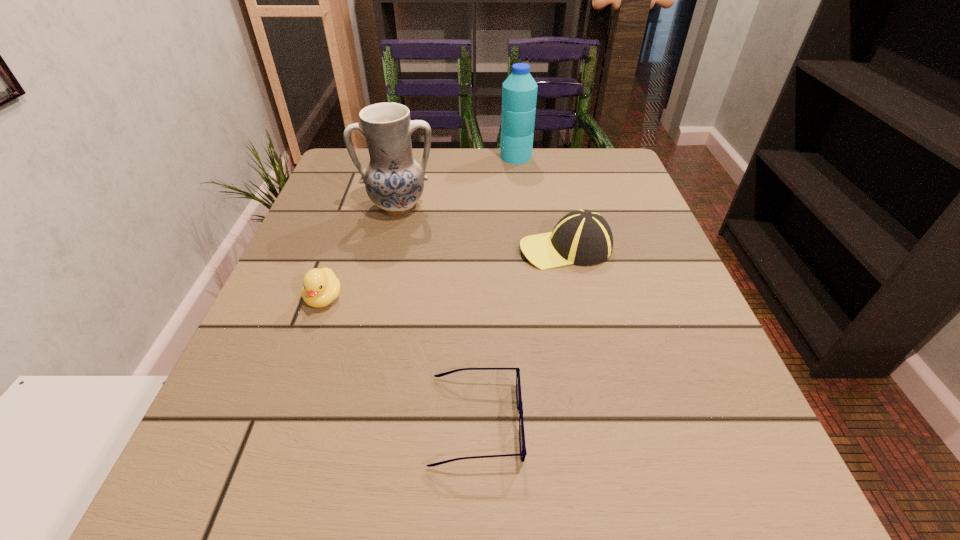
You are a GUI agent. You are given a task and a screenshot of the screen. Output one action in this format:
    pyautogui.click(x=<x>, y=<y>)
    Task: Click on the vacant space at the far edge of the desktop
    
    Given the screenshot: What is the action you would take?
    pyautogui.click(x=433, y=167)

In the image, there is a desktop. Find the location of `free space at the left edge`. free space at the left edge is located at coordinates (232, 416).

In the image, there is a desktop. Identify the location of vacant region at the right edge. (627, 291).

You are a GUI agent. You are given a task and a screenshot of the screen. Output one action in this format:
    pyautogui.click(x=<x>, y=<y>)
    Task: Click on the free space at the far left corner
    
    Given the screenshot: What is the action you would take?
    pyautogui.click(x=349, y=179)

In the image, there is a desktop. At what (x,y) coordinates should I click in order to perform the action: click on vacant space at the near left corner. Please return your answer as a coordinate pair (x, y). Image resolution: width=960 pixels, height=540 pixels. Looking at the image, I should click on (177, 503).

In the image, there is a desktop. Where is `vacant space at the far right corner`? vacant space at the far right corner is located at coordinates (632, 184).

In the image, there is a desktop. Where is `free space at the near right corner`? The height and width of the screenshot is (540, 960). free space at the near right corner is located at coordinates (727, 515).

Locate an element on the screen. This screenshot has width=960, height=540. free point between the second farthest object and the nearest object is located at coordinates (438, 314).

Identify the location of unoccupied position between the second farthest object and the baseball cap. (482, 227).

You are a GUI agent. You are given a task and a screenshot of the screen. Output one action in this format:
    pyautogui.click(x=<x>, y=<y>)
    Task: Click on the free area in between the spectacles and the water bottle
    
    Given the screenshot: What is the action you would take?
    pyautogui.click(x=496, y=289)